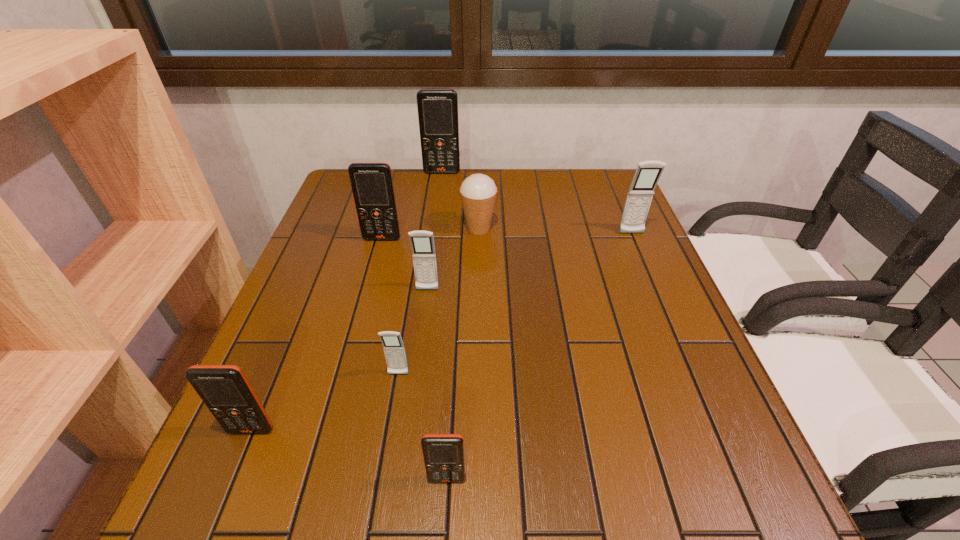
Find the location of a particular element. The height and width of the screenshot is (540, 960). the farthest object is located at coordinates (437, 108).

Find the location of a particular element. the biggest orange cellular telephone is located at coordinates (437, 108).

Locate an element on the screen. the rightmost cellular telephone is located at coordinates 640,194.

Locate an element on the screen. The width and height of the screenshot is (960, 540). the biggest gray cellular telephone is located at coordinates (640, 194).

Locate an element on the screen. This screenshot has width=960, height=540. the seventh object from right to left is located at coordinates (372, 185).

This screenshot has width=960, height=540. I want to click on the third orange cellular telephone from right to left, so click(372, 185).

The image size is (960, 540). I want to click on the fourth farthest cellular telephone, so click(x=422, y=242).

The image size is (960, 540). I want to click on the second smallest gray cellular telephone, so click(x=422, y=242).

Locate an element on the screen. The height and width of the screenshot is (540, 960). the leftmost orange cellular telephone is located at coordinates (225, 390).

Locate an element on the screen. the seventh farthest object is located at coordinates (225, 390).